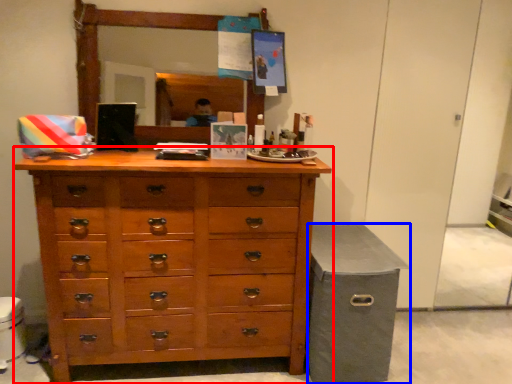
Question: Among these objects, which one is nearest to the camera, chest of drawers (highlighted by a red box) or cabinetry (highlighted by a blue box)?

Choices:
 (A) chest of drawers
 (B) cabinetry

Answer: (A)